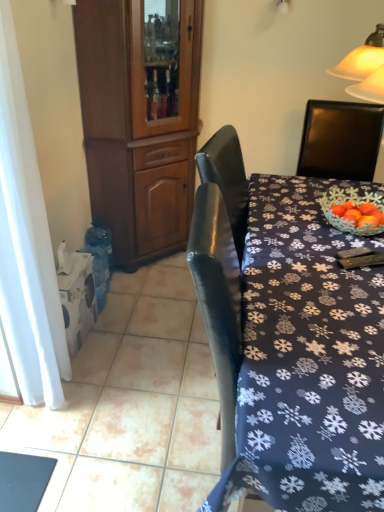
Question: Is brown wood cabinet at left situated inside dark blue fabric tablecloth at center or outside?

Choices:
 (A) inside
 (B) outside

Answer: (B)

Question: Is brown wood cabinet at left to the left or to the right of dark blue fabric tablecloth at center in the image?

Choices:
 (A) left
 (B) right

Answer: (A)

Question: Which of these objects is positioned closest to the white sheer curtain at left?

Choices:
 (A) brown wood cabinet at left
 (B) dark blue fabric tablecloth at center

Answer: (B)

Question: Estimate the real-world distances between objects in this image. Which object is farther from the brown wood cabinet at left?

Choices:
 (A) dark blue fabric tablecloth at center
 (B) white sheer curtain at left

Answer: (A)